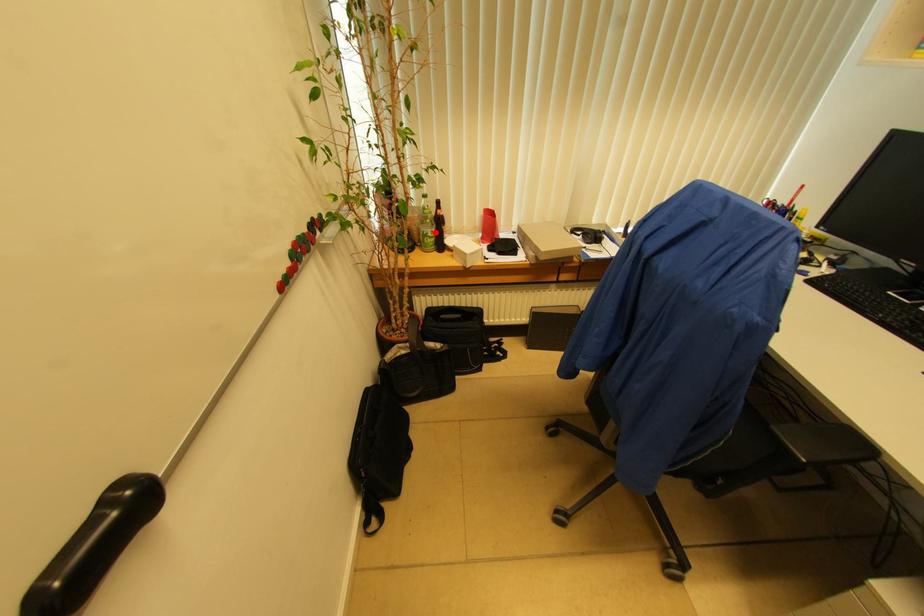
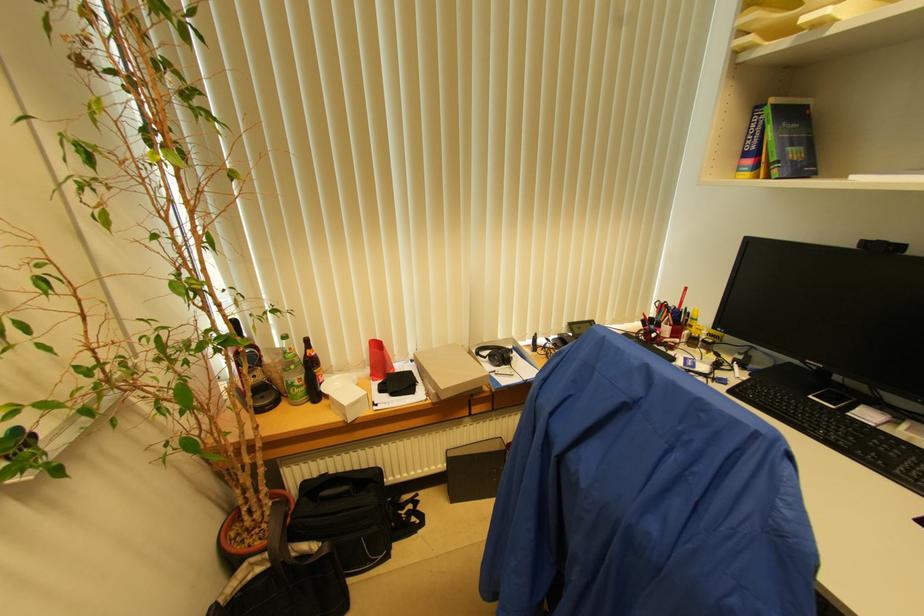
Where in the second image is the point corresponding to the highlighted location from the first image?

(304, 379)